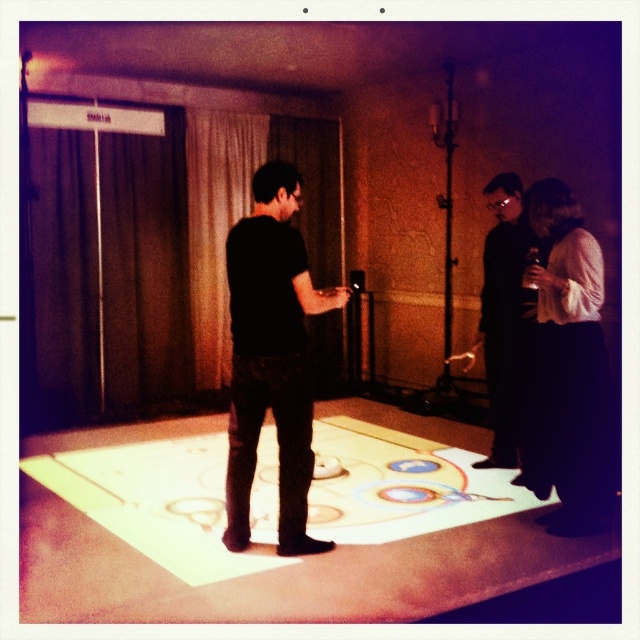
Does white matte dress at right have a lesser width compared to black matte suit at right?

No.

Is point (579, 486) positioned behind point (506, 467)?

No, (579, 486) is in front of (506, 467).

Between point (572, 348) and point (484, 284), which one is positioned in front?

Point (572, 348) is more forward.

You are a GUI agent. You are given a task and a screenshot of the screen. Output one action in this format:
    pyautogui.click(x=<x>, y=<y>)
    Task: Click on the white matte dress at right
    The height and width of the screenshot is (640, 640).
    Given the screenshot: What is the action you would take?
    coord(570,368)

Who is more forward, (237,493) or (515,374)?

Positioned in front is point (237,493).

Does black matte shirt at center have a smaller size compared to black matte suit at right?

Correct, black matte shirt at center occupies less space than black matte suit at right.

I want to click on black matte shirt at center, so click(x=272, y=356).

Consider the image. Between black matte shirt at center and white matte dress at right, which one has less height?

white matte dress at right

Is point (243, 221) closer to viewer compared to point (580, 268)?

Yes, point (243, 221) is in front of point (580, 268).

Find the location of a particular element. The height and width of the screenshot is (640, 640). black matte shirt at center is located at coordinates (272, 356).